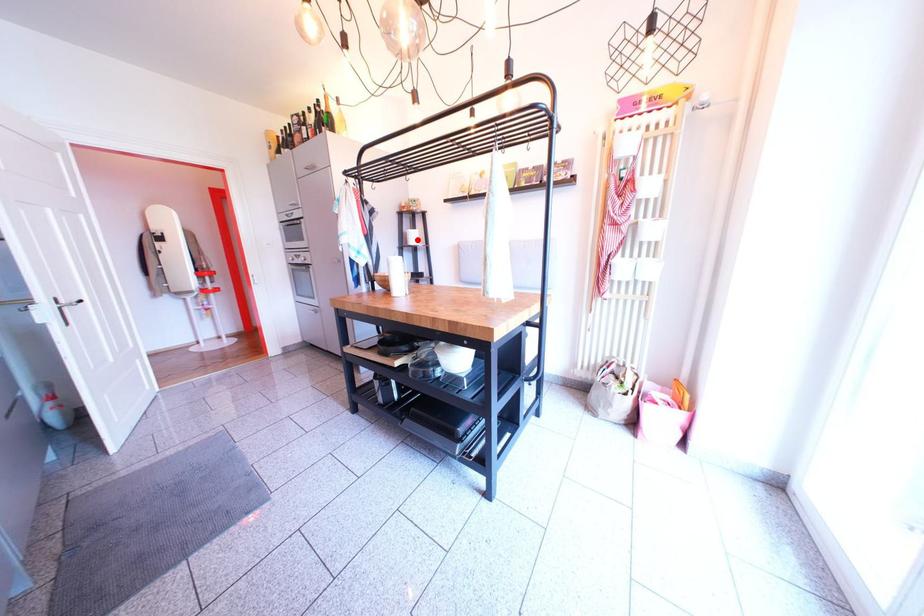
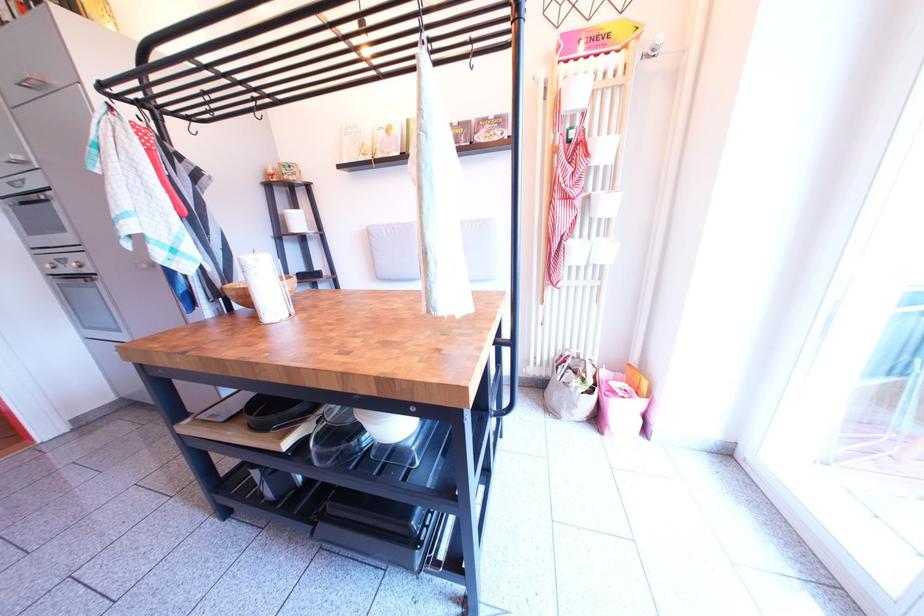
Question: I am providing you with two images of the same scene from different viewpoints. A red point is shown in image1. For the corresponding object point in image2, is it positioned nearer or farther from the camera?

Choices:
 (A) Nearer
 (B) Farther

Answer: (B)